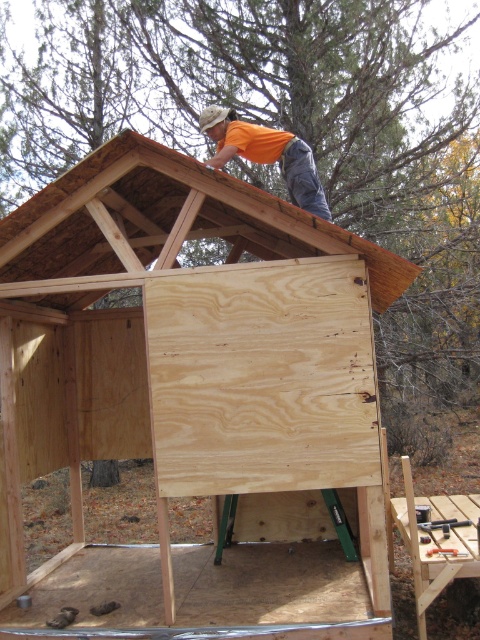
Is point (132, 392) less distant than point (252, 156)?

No, it is not.

Who is positioned more to the right, plywood at upper center or orange t-shirt at upper center?

From the viewer's perspective, orange t-shirt at upper center appears more on the right side.

Does point (240, 428) come closer to viewer compared to point (307, 182)?

Yes.

Where is `plywood at upper center`? Image resolution: width=480 pixels, height=640 pixels. plywood at upper center is located at coordinates (194, 400).

Which is below, plywoodwoodenpanel at center or brown wood at upper center?

Positioned lower is plywoodwoodenpanel at center.

This screenshot has width=480, height=640. Identify the location of plywoodwoodenpanel at center. (262, 378).

Is the position of brown wood at upper center less distant than that of orange t-shirt at upper center?

Yes, brown wood at upper center is closer to the viewer.

Which is behind, point (84, 257) or point (231, 122)?

Positioned behind is point (84, 257).

Where is `brown wood at upper center`? This screenshot has width=480, height=640. brown wood at upper center is located at coordinates (170, 220).